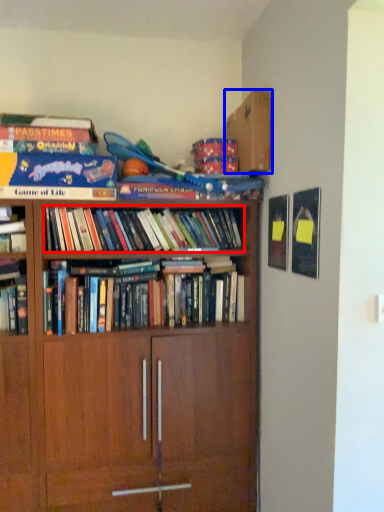
Question: Among these objects, which one is nearest to the camera, book (highlighted by a red box) or cardboard box (highlighted by a blue box)?

Choices:
 (A) book
 (B) cardboard box

Answer: (A)